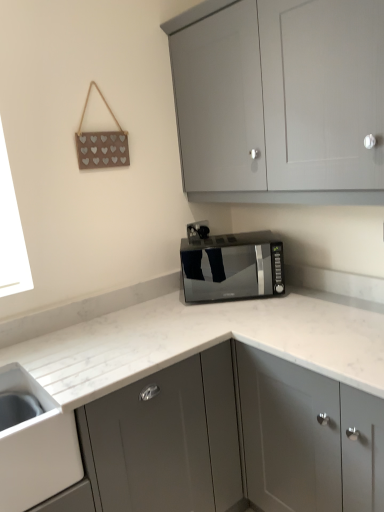
Where is `satin grey cabinet at center, which ranks as the second cabinetry in top-to-bottom order`? satin grey cabinet at center, which ranks as the second cabinetry in top-to-bottom order is located at coordinates (234, 438).

This screenshot has width=384, height=512. Describe the element at coordinates (280, 100) in the screenshot. I see `matte gray cabinet at upper center, which ranks as the first cabinetry in top-to-bottom order` at that location.

The image size is (384, 512). I want to click on satin black microwave at center, so click(232, 267).

Image resolution: width=384 pixels, height=512 pixels. Describe the element at coordinates (36, 448) in the screenshot. I see `white glossy sink at lower left` at that location.

Where is `satin grey cabinet at center, which ranks as the second cabinetry in top-to-bottom order`? satin grey cabinet at center, which ranks as the second cabinetry in top-to-bottom order is located at coordinates (234, 438).

Which is closer to the camera, (193, 234) or (210, 271)?

Point (193, 234) is positioned closer to the camera compared to point (210, 271).

Considering the sizes of objects black plastic electric outlet at center and satin black microwave at center in the image provided, who is taller, black plastic electric outlet at center or satin black microwave at center?

satin black microwave at center is taller.

Is black plastic electric outlet at center far from satin black microwave at center?

They are positioned close to each other.

Which of these two, satin grey cabinet at center, which ranks as the second cabinetry in top-to-bottom order, or black plastic electric outlet at center, is bigger?

satin grey cabinet at center, which ranks as the second cabinetry in top-to-bottom order, is bigger.

Locate an element on the screen. Image resolution: width=384 pixels, height=512 pixels. electric outlet above the satin grey cabinet at center, which ranks as the second cabinetry in top-to-bottom order (from the image's perspective) is located at coordinates (198, 230).

Are satin grey cabinet at center, which ranks as the second cabinetry in top-to-bottom order, and black plastic electric outlet at center far apart?

No, satin grey cabinet at center, which ranks as the second cabinetry in top-to-bottom order, is in close proximity to black plastic electric outlet at center.

Is satin grey cabinet at center, arranged as the 1th cabinetry when ordered from the bottom, taller than black plastic electric outlet at center?

Correct, satin grey cabinet at center, arranged as the 1th cabinetry when ordered from the bottom, is much taller as black plastic electric outlet at center.

Between satin black microwave at center and matte gray cabinet at upper center, the second cabinetry when ordered from bottom to top, which one has more height?

Standing taller between the two is matte gray cabinet at upper center, the second cabinetry when ordered from bottom to top.

How much distance is there between satin black microwave at center and matte gray cabinet at upper center, the second cabinetry when ordered from bottom to top?

satin black microwave at center is 26.73 inches away from matte gray cabinet at upper center, the second cabinetry when ordered from bottom to top.

Considering the points (242, 279) and (188, 72), which point is in front, point (242, 279) or point (188, 72)?

The point (188, 72) is in front.

In the scene shown: From the image's perspective, is satin black microwave at center over matte gray cabinet at upper center, which ranks as the first cabinetry in top-to-bottom order?

No.

Where is `home appliance located behind the matte gray cabinet at upper center, the second cabinetry when ordered from bottom to top`? This screenshot has height=512, width=384. home appliance located behind the matte gray cabinet at upper center, the second cabinetry when ordered from bottom to top is located at coordinates pyautogui.click(x=232, y=267).

Is matte gray cabinet at upper center, which ranks as the first cabinetry in top-to-bottom order, taller or shorter than satin black microwave at center?

Considering their sizes, matte gray cabinet at upper center, which ranks as the first cabinetry in top-to-bottom order, has more height than satin black microwave at center.

From the image's perspective, between matte gray cabinet at upper center, the second cabinetry when ordered from bottom to top, and satin black microwave at center, which one is located above?

matte gray cabinet at upper center, the second cabinetry when ordered from bottom to top.

Does matte gray cabinet at upper center, which ranks as the first cabinetry in top-to-bottom order, appear on the left side of satin black microwave at center?

Incorrect, matte gray cabinet at upper center, which ranks as the first cabinetry in top-to-bottom order, is not on the left side of satin black microwave at center.

Based on their positions, is white glossy sink at lower left located to the left or right of satin black microwave at center?

Clearly, white glossy sink at lower left is on the left of satin black microwave at center in the image.

Is white glossy sink at lower left not inside satin black microwave at center?

white glossy sink at lower left lies outside satin black microwave at center's area.

Where is `home appliance above the white glossy sink at lower left (from a real-world perspective)`? Image resolution: width=384 pixels, height=512 pixels. home appliance above the white glossy sink at lower left (from a real-world perspective) is located at coordinates (232, 267).

From the picture: Is white glossy sink at lower left further to camera compared to satin black microwave at center?

No, white glossy sink at lower left is in front of satin black microwave at center.

Considering the relative sizes of satin black microwave at center and white glossy sink at lower left in the image provided, is satin black microwave at center smaller than white glossy sink at lower left?

Yes.

Is satin black microwave at center completely or partially outside of white glossy sink at lower left?

Yes, satin black microwave at center is located beyond the bounds of white glossy sink at lower left.

Between satin black microwave at center and white glossy sink at lower left, which one appears on the left side from the viewer's perspective?

white glossy sink at lower left is more to the left.

Is satin black microwave at center not near white glossy sink at lower left?

No, satin black microwave at center is not far away from white glossy sink at lower left.

Between black plastic electric outlet at center and matte gray cabinet at upper center, which ranks as the first cabinetry in top-to-bottom order, which one has larger size?

matte gray cabinet at upper center, which ranks as the first cabinetry in top-to-bottom order.

Is matte gray cabinet at upper center, the second cabinetry when ordered from bottom to top, a part of black plastic electric outlet at center?

Definitely not — matte gray cabinet at upper center, the second cabinetry when ordered from bottom to top, is not inside black plastic electric outlet at center.

From a real-world perspective, does black plastic electric outlet at center sit lower than matte gray cabinet at upper center, which ranks as the first cabinetry in top-to-bottom order?

Indeed, from a real-world perspective, black plastic electric outlet at center is positioned beneath matte gray cabinet at upper center, which ranks as the first cabinetry in top-to-bottom order.

In the image, there is a satin black microwave at center. Where is `electric outlet above it (from the image's perspective)`? electric outlet above it (from the image's perspective) is located at coordinates point(198,230).

Locate an element on the screen. Image resolution: width=384 pixels, height=512 pixels. electric outlet lying behind the satin grey cabinet at center, arranged as the 1th cabinetry when ordered from the bottom is located at coordinates (198, 230).

From the image, which object appears to be farther from satin black microwave at center, satin grey cabinet at center, which ranks as the second cabinetry in top-to-bottom order, or matte gray cabinet at upper center, the second cabinetry when ordered from bottom to top?

matte gray cabinet at upper center, the second cabinetry when ordered from bottom to top, is positioned further to the anchor satin black microwave at center.

When comparing their distances from matte gray cabinet at upper center, the second cabinetry when ordered from bottom to top, does white glossy sink at lower left or satin black microwave at center seem further?

white glossy sink at lower left is further to matte gray cabinet at upper center, the second cabinetry when ordered from bottom to top.

Looking at the image, which one is located closer to satin grey cabinet at center, arranged as the 1th cabinetry when ordered from the bottom, matte gray cabinet at upper center, the second cabinetry when ordered from bottom to top, or satin black microwave at center?

satin black microwave at center is positioned closer to the anchor satin grey cabinet at center, arranged as the 1th cabinetry when ordered from the bottom.

When comparing their distances from satin grey cabinet at center, arranged as the 1th cabinetry when ordered from the bottom, does matte gray cabinet at upper center, the second cabinetry when ordered from bottom to top, or white glossy sink at lower left seem closer?

white glossy sink at lower left lies closer to satin grey cabinet at center, arranged as the 1th cabinetry when ordered from the bottom, than the other object.

Looking at the image, which one is located closer to matte gray cabinet at upper center, the second cabinetry when ordered from bottom to top, black plastic electric outlet at center or white glossy sink at lower left?

Based on the image, black plastic electric outlet at center appears to be nearer to matte gray cabinet at upper center, the second cabinetry when ordered from bottom to top.

Which object lies further to the anchor point matte gray cabinet at upper center, the second cabinetry when ordered from bottom to top, black plastic electric outlet at center or satin black microwave at center?

black plastic electric outlet at center.

From the image, which object appears to be nearer to black plastic electric outlet at center, satin black microwave at center or satin grey cabinet at center, arranged as the 1th cabinetry when ordered from the bottom?

The object closer to black plastic electric outlet at center is satin black microwave at center.

Looking at the image, which one is located further to white glossy sink at lower left, satin grey cabinet at center, which ranks as the second cabinetry in top-to-bottom order, or satin black microwave at center?

satin black microwave at center is positioned further to the anchor white glossy sink at lower left.

This screenshot has height=512, width=384. I want to click on home appliance located between white glossy sink at lower left and satin grey cabinet at center, which ranks as the second cabinetry in top-to-bottom order, in the left-right direction, so click(232, 267).

Find the location of a particular element. The height and width of the screenshot is (512, 384). sink between matte gray cabinet at upper center, which ranks as the first cabinetry in top-to-bottom order, and satin grey cabinet at center, arranged as the 1th cabinetry when ordered from the bottom, in the vertical direction is located at coordinates (36, 448).

The width and height of the screenshot is (384, 512). Find the location of `home appliance positioned between matte gray cabinet at upper center, which ranks as the first cabinetry in top-to-bottom order, and black plastic electric outlet at center from near to far`. home appliance positioned between matte gray cabinet at upper center, which ranks as the first cabinetry in top-to-bottom order, and black plastic electric outlet at center from near to far is located at coordinates (232, 267).

This screenshot has height=512, width=384. I want to click on home appliance between satin grey cabinet at center, which ranks as the second cabinetry in top-to-bottom order, and black plastic electric outlet at center, along the z-axis, so click(x=232, y=267).